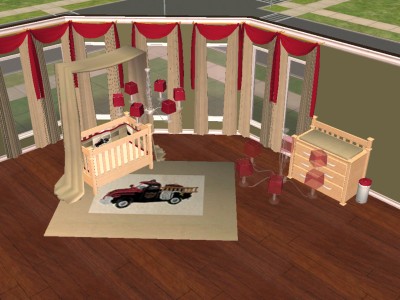
Identify the location of drapes. (10, 39), (42, 34), (91, 31), (152, 31), (216, 30), (259, 35), (283, 45).